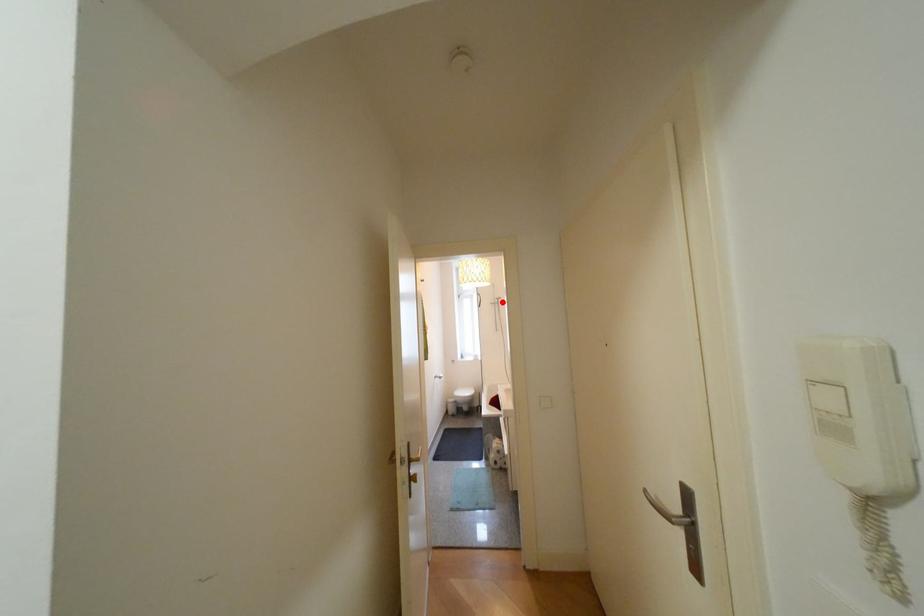
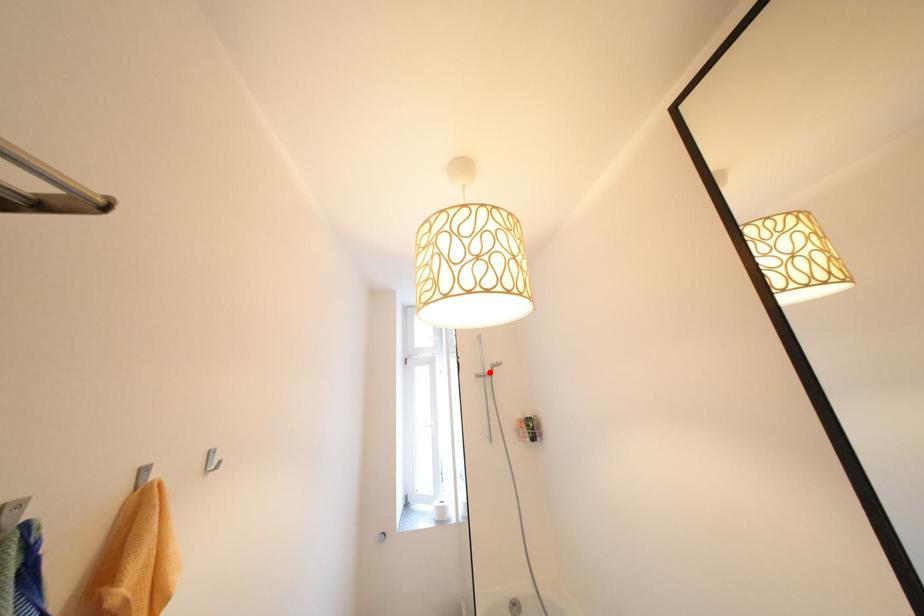
I am providing you with two images of the same scene from different viewpoints. A red point is marked on the first image and another point is marked on the second image. Are the points marked in image1 and image2 representing the same 3D position?

Yes